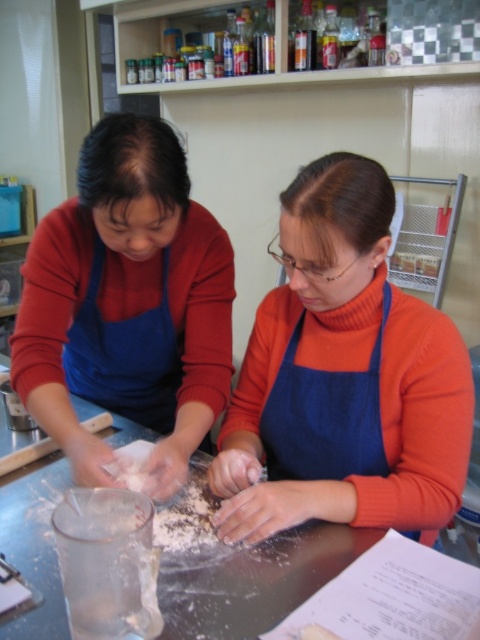
Which is behind, point (370, 433) or point (197, 593)?

Point (370, 433)

Is blue fabric apron at center taller than metallic gray table at center?

Indeed, blue fabric apron at center has a greater height compared to metallic gray table at center.

Does point (419, 500) lie in front of point (84, 417)?

That is True.

The image size is (480, 640). I want to click on blue fabric apron at center, so click(x=344, y=378).